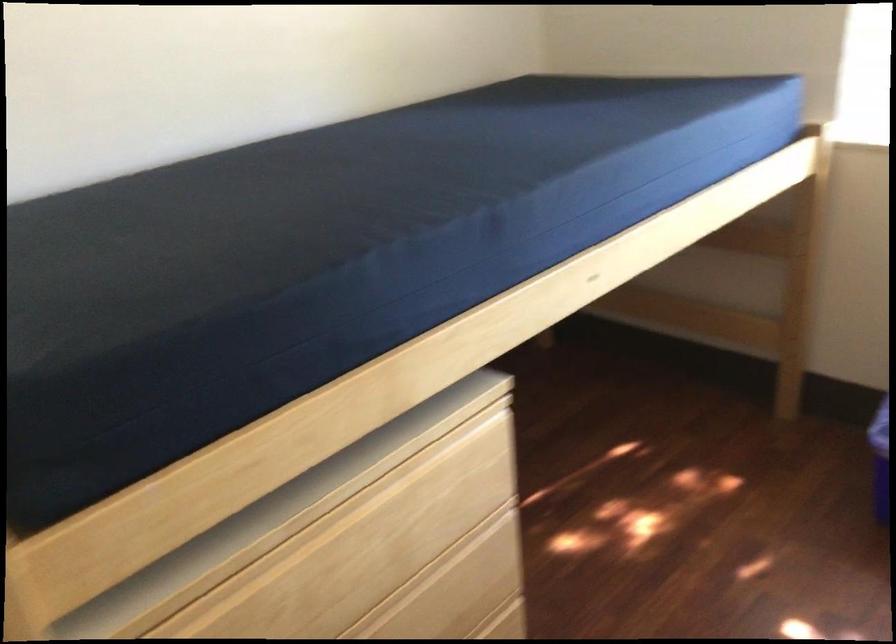
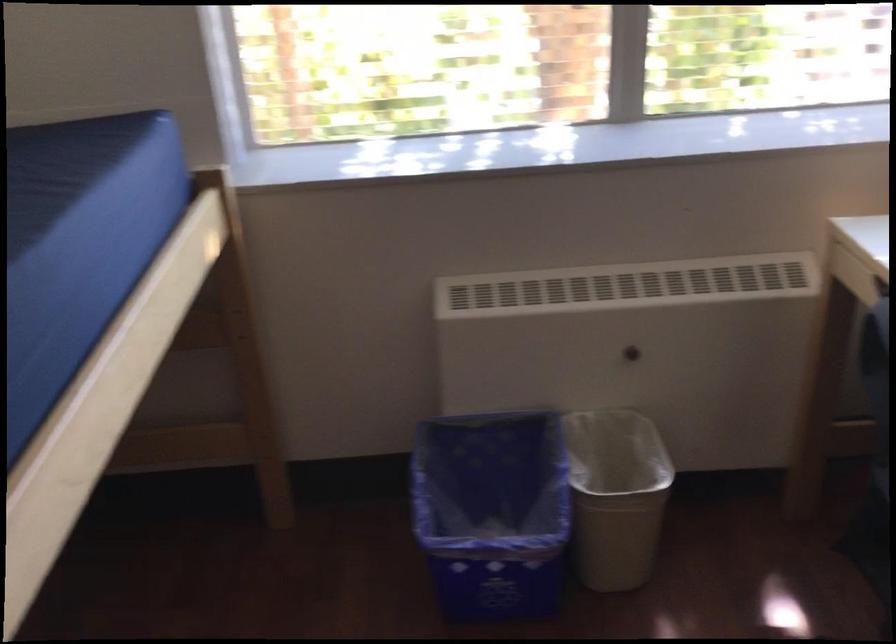
Question: The camera is either moving clockwise (left) or counter-clockwise (right) around the object. The first image is from the beginning of the video and the second image is from the end. Is the camera moving left or right when shooting the video?

Choices:
 (A) Left
 (B) Right

Answer: (A)